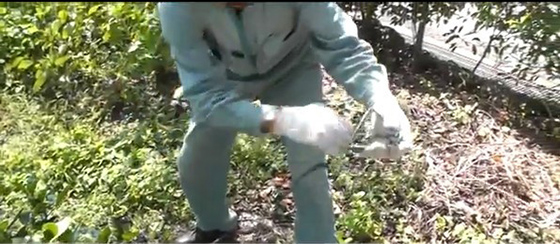
Locate an element on the screen. shoe is located at coordinates (203, 236).